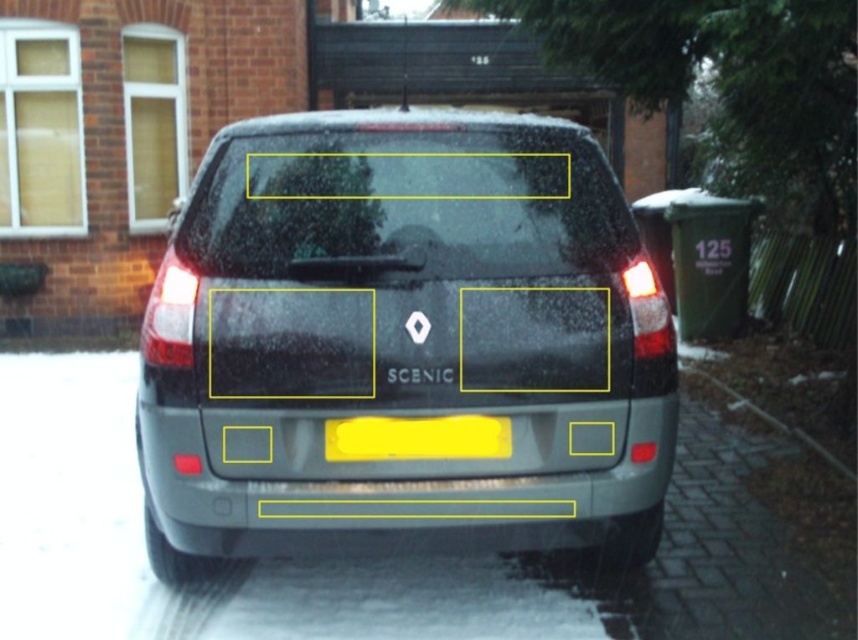
Question: Does transparent glass windshield at upper center appear under yellow matte license plate at center?

Choices:
 (A) yes
 (B) no

Answer: (B)

Question: Is satin silver car at center positioned in front of yellow matte license plate at center?

Choices:
 (A) no
 (B) yes

Answer: (B)

Question: Which of these objects is positioned farthest from the yellow matte license plate at center?

Choices:
 (A) satin silver car at center
 (B) transparent glass windshield at upper center

Answer: (B)

Question: Which point is farther to the camera?

Choices:
 (A) satin silver car at center
 (B) yellow matte license plate at center

Answer: (B)

Question: Which point is closer to the camera taking this photo?

Choices:
 (A) (581, 138)
 (B) (426, 200)
 (C) (349, 426)

Answer: (C)

Question: Where is satin silver car at center located in relation to transparent glass windshield at upper center in the image?

Choices:
 (A) above
 (B) below

Answer: (B)